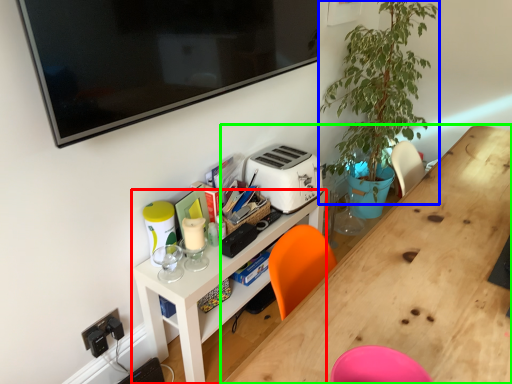
Question: Considering the real-world distances, which object is farthest from shelf (highlighted by a red box)? plant (highlighted by a blue box) or desk (highlighted by a green box)?

Choices:
 (A) plant
 (B) desk

Answer: (A)